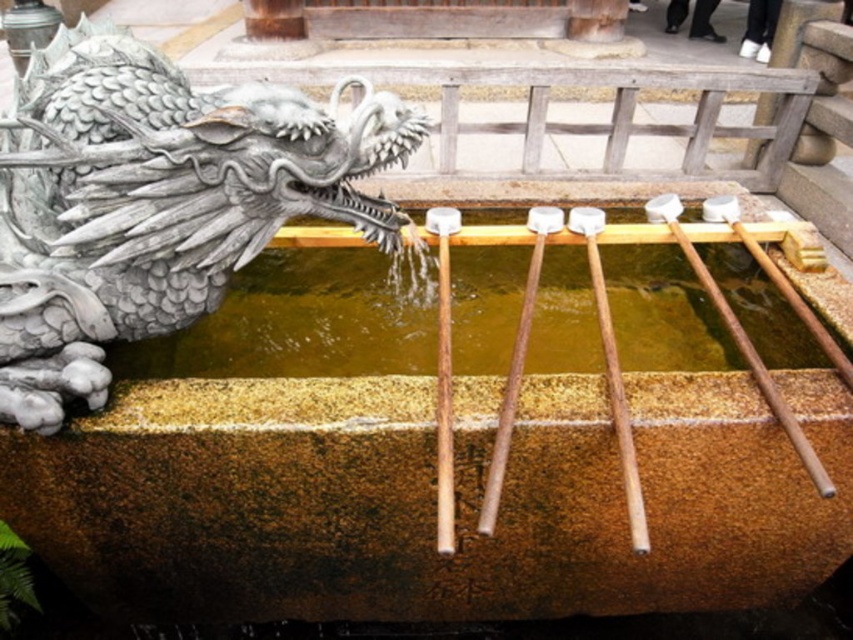
Does gray stone dragon head at left appear on the right side of yellowish stone water at center?

No, gray stone dragon head at left is not to the right of yellowish stone water at center.

Between gray stone dragon head at left and yellowish stone water at center, which one has less height?

With less height is yellowish stone water at center.

Does point (68, 372) come in front of point (294, 257)?

Yes.

Identify the location of gray stone dragon head at left. Image resolution: width=853 pixels, height=640 pixels. (155, 202).